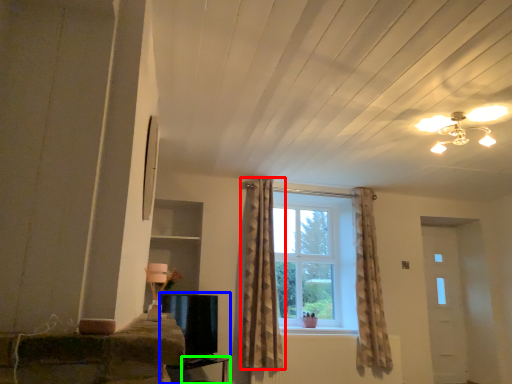
Question: Estimate the real-world distances between objects in this image. Which object is closer to curtain (highlighted by a red box), entertainment center (highlighted by a blue box) or table (highlighted by a green box)?

Choices:
 (A) entertainment center
 (B) table

Answer: (A)